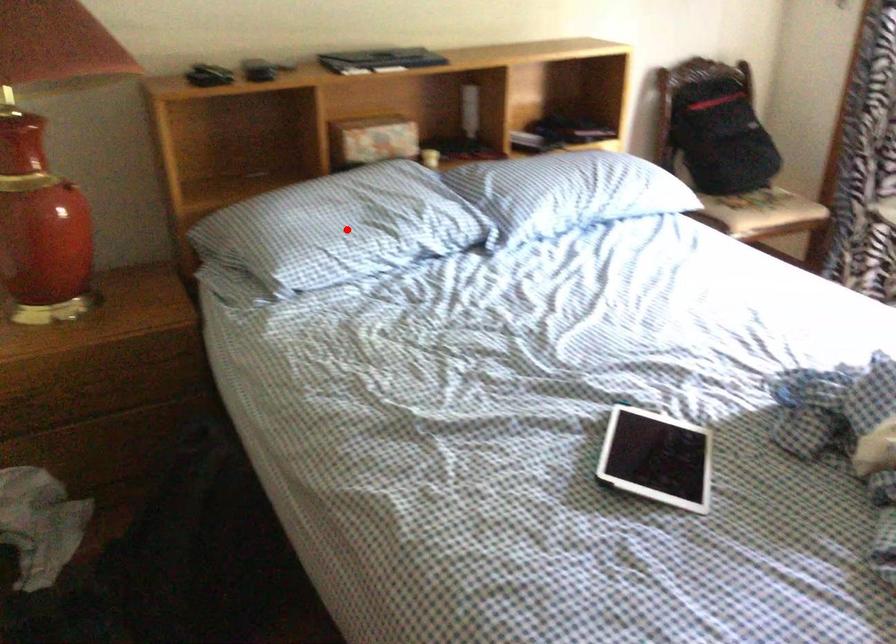
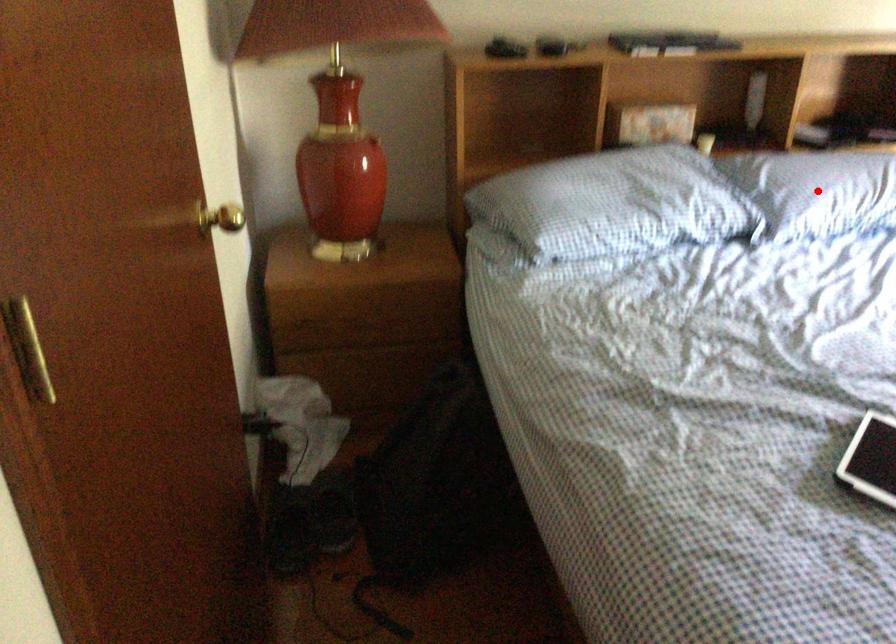
Looking at this image, I am providing you with two images of the same scene from different viewpoints. A red point is marked on the first image and another point is marked on the second image. Is the marked point in image1 the same physical position as the marked point in image2?

No